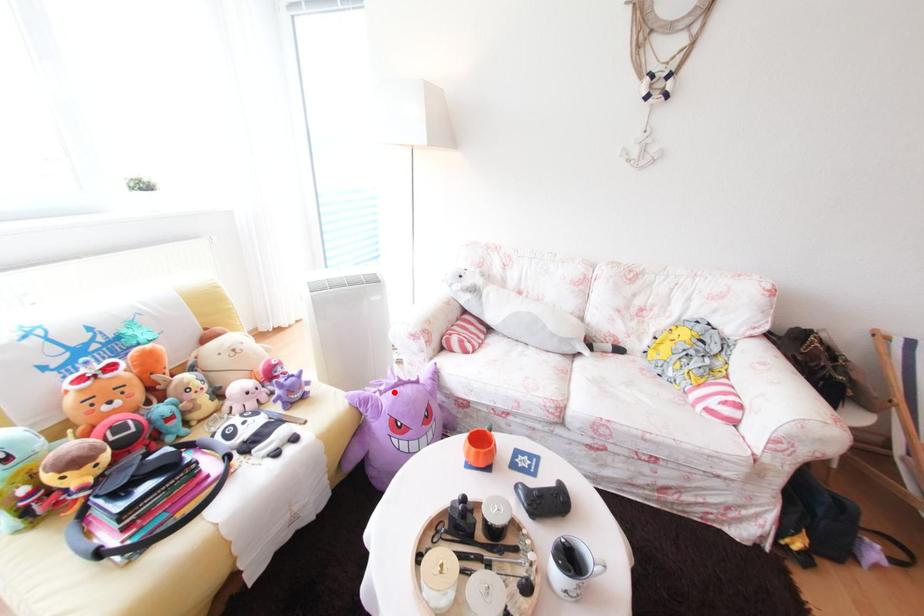
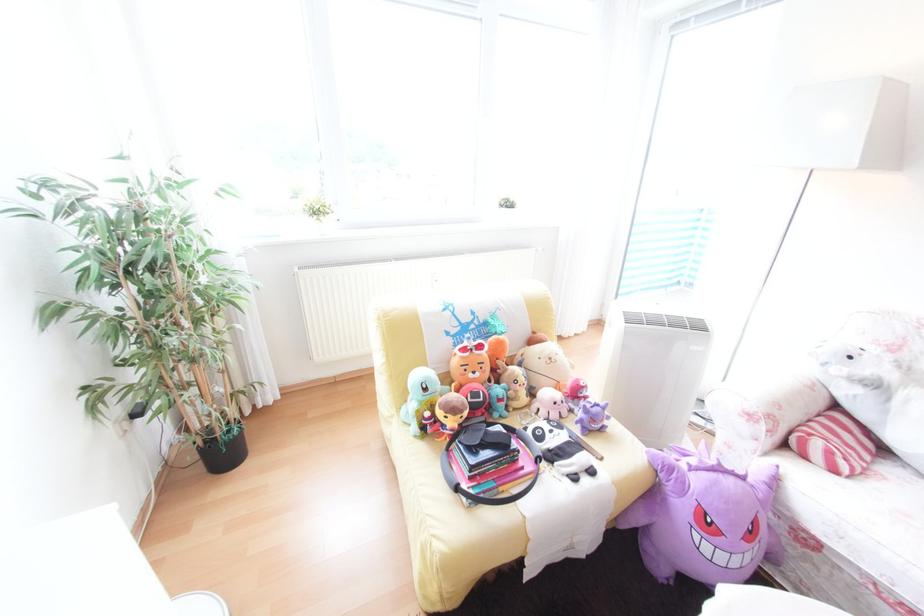
Where in the second image is the point corresponding to the highlighted location from the first image?

(706, 469)